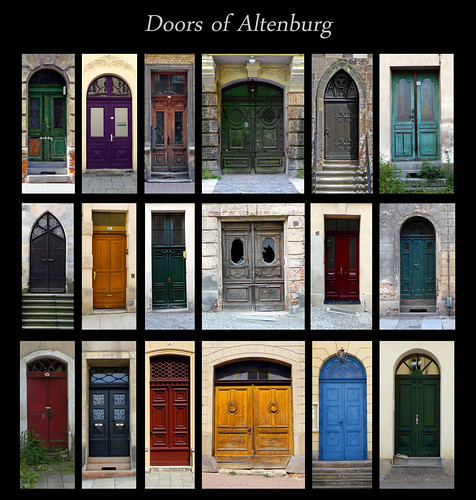
You are a GUI agent. You are given a task and a screenshot of the screen. Output one action in this format:
    pyautogui.click(x=<x>, y=<y>)
    Task: Click on the stairs
    The width and height of the screenshot is (476, 500).
    Given the screenshot: What is the action you would take?
    point(51,169), point(172,172), point(343,173), point(423,170), point(47,302), point(107,462), point(348,469), point(416,463), point(419,306), point(340,308)